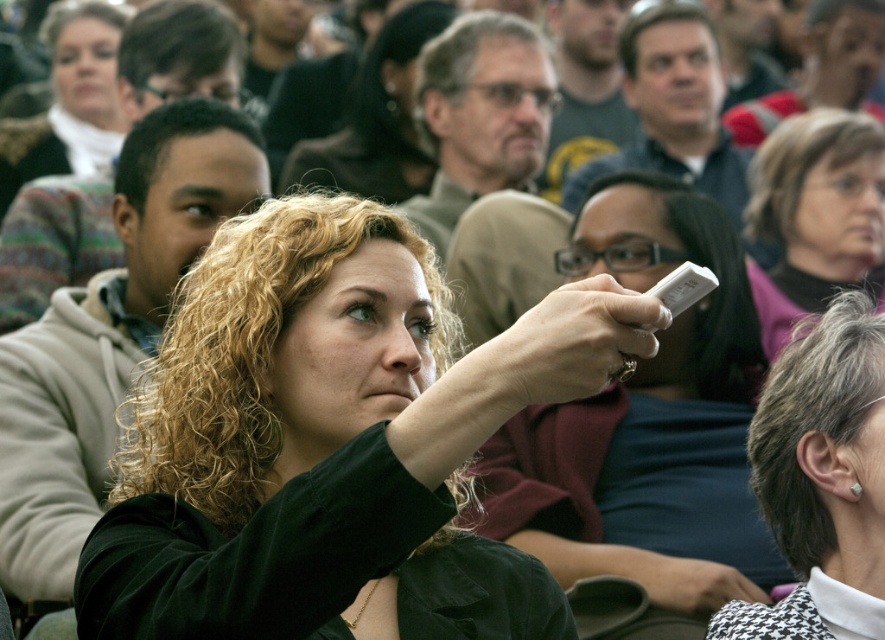
Question: Is the position of black fabric shirt at center less distant than that of blonde curly hair at center?

Choices:
 (A) yes
 (B) no

Answer: (A)

Question: Does purple turtleneck sweater at upper right have a greater width compared to matte black hoodie at upper left?

Choices:
 (A) no
 (B) yes

Answer: (A)

Question: Which object is closer to the camera taking this photo?

Choices:
 (A) purple turtleneck sweater at upper right
 (B) black fabric shirt at center
 (C) matte black phone at center

Answer: (C)

Question: Which object is positioned closest to the matte gray shirt at upper center?

Choices:
 (A) matte black hoodie at upper left
 (B) white houndstooth blazer at lower right

Answer: (A)

Question: Which point is closer to the camera taking this photo?

Choices:
 (A) (647, 35)
 (B) (637, 225)
 (C) (805, 589)
 (D) (437, 4)

Answer: (C)

Question: Can you confirm if matte black phone at center is bigger than matte black hoodie at upper left?

Choices:
 (A) yes
 (B) no

Answer: (A)